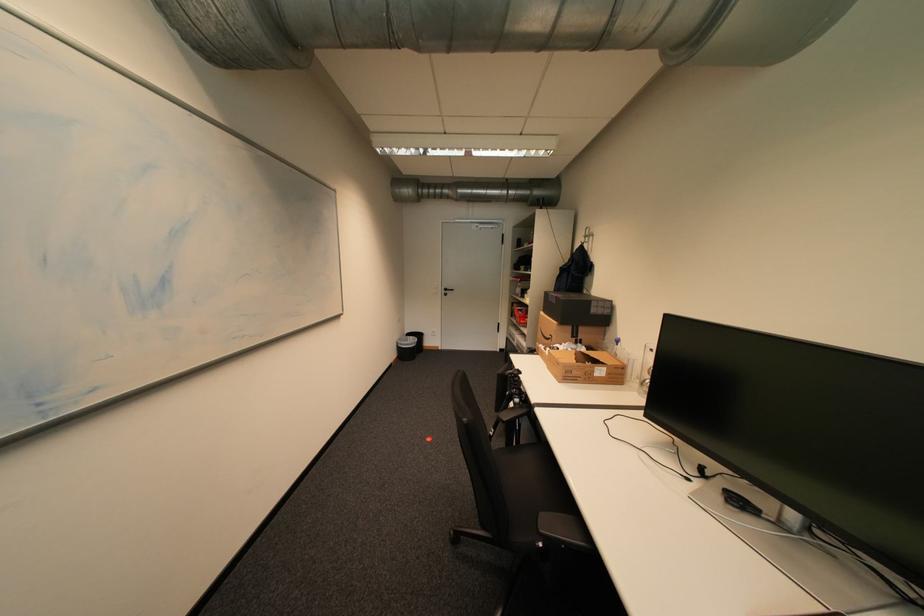
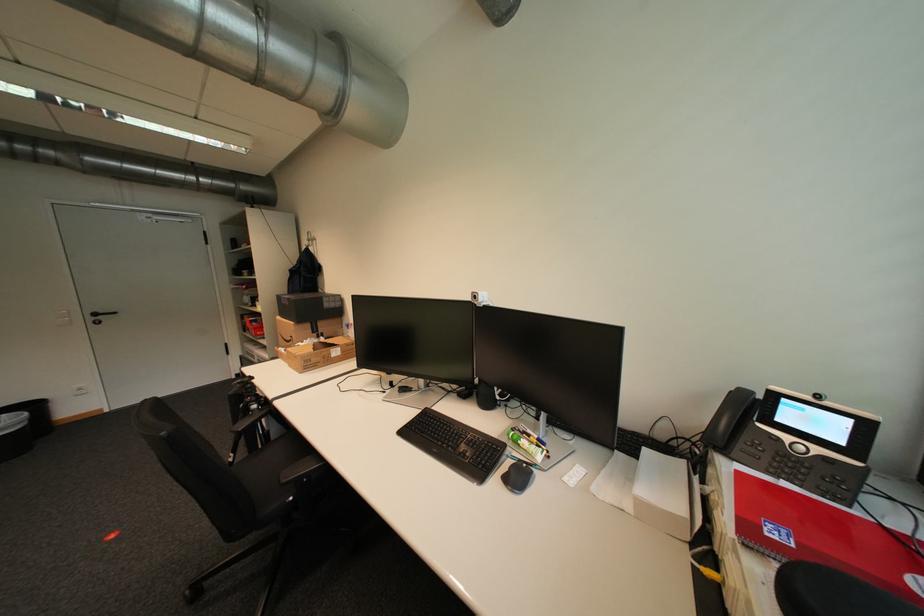
In the second image, find the point that corresponds to pixel 506 351 in the first image.

(242, 378)